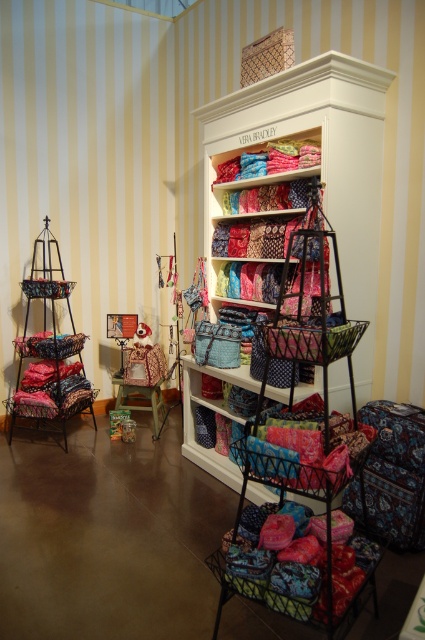
Between metallic wire basket at left and wooden stool at center, which one appears on the left side from the viewer's perspective?

Positioned to the left is metallic wire basket at left.

What do you see at coordinates (48, 348) in the screenshot? Image resolution: width=425 pixels, height=640 pixels. I see `metallic wire basket at left` at bounding box center [48, 348].

The image size is (425, 640). In order to click on metallic wire basket at left in this screenshot , I will do `click(48, 348)`.